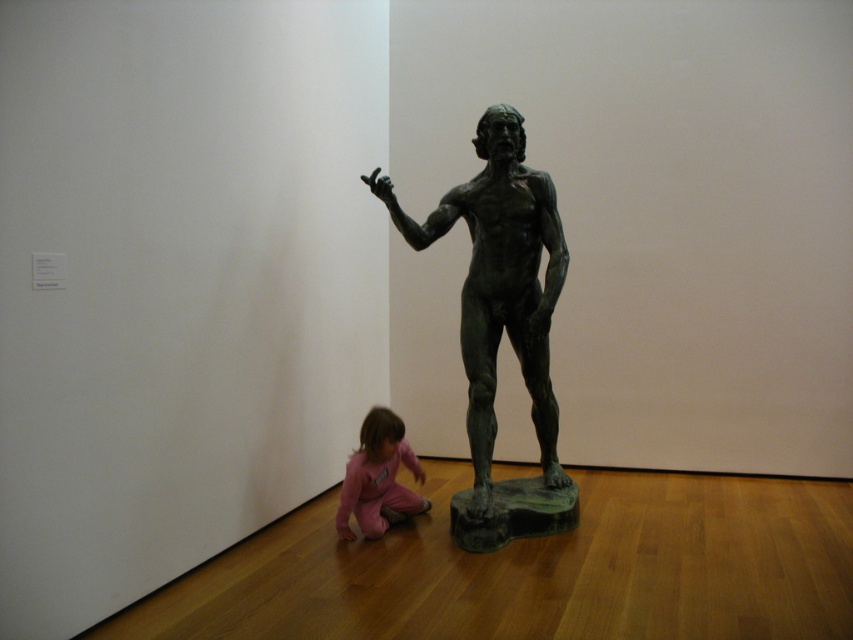
Question: Can you confirm if green patina bronze statue at center is positioned to the right of pink fabric child at lower center?

Choices:
 (A) no
 (B) yes

Answer: (B)

Question: Does green patina bronze statue at center lie in front of pink fabric child at lower center?

Choices:
 (A) no
 (B) yes

Answer: (B)

Question: Does green patina bronze statue at center have a greater width compared to pink fabric child at lower center?

Choices:
 (A) yes
 (B) no

Answer: (A)

Question: Which point appears farthest from the camera in this image?

Choices:
 (A) (393, 508)
 (B) (471, 248)

Answer: (B)

Question: Which of the following is the farthest from the observer?

Choices:
 (A) (366, 480)
 (B) (486, 147)

Answer: (B)

Question: Which object appears closest to the camera in this image?

Choices:
 (A) pink fabric child at lower center
 (B) green patina bronze statue at center

Answer: (B)